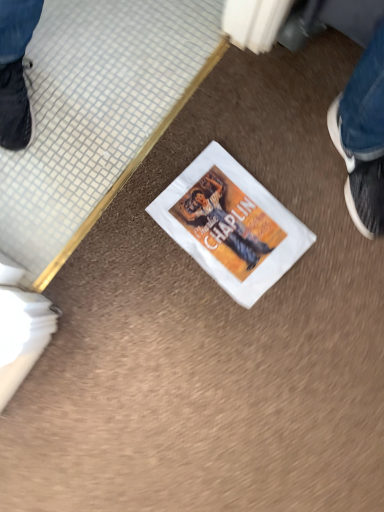
Identify the location of blank space situated above white paper comic book at center (from a real-world perspective). Image resolution: width=384 pixels, height=512 pixels. (230, 227).